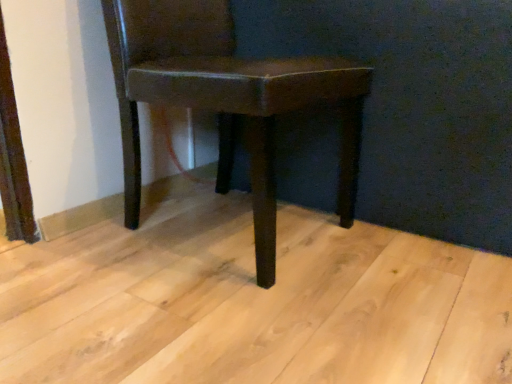
The image size is (512, 384). What are the coordinates of `matte brown leather chair at center` in the screenshot? It's located at (226, 99).

This screenshot has width=512, height=384. Describe the element at coordinates (226, 99) in the screenshot. I see `matte brown leather chair at center` at that location.

You are a GUI agent. You are given a task and a screenshot of the screen. Output one action in this format:
    pyautogui.click(x=<x>, y=<y>)
    Task: Click on the matte brown leather chair at center
    
    Given the screenshot: What is the action you would take?
    pyautogui.click(x=226, y=99)